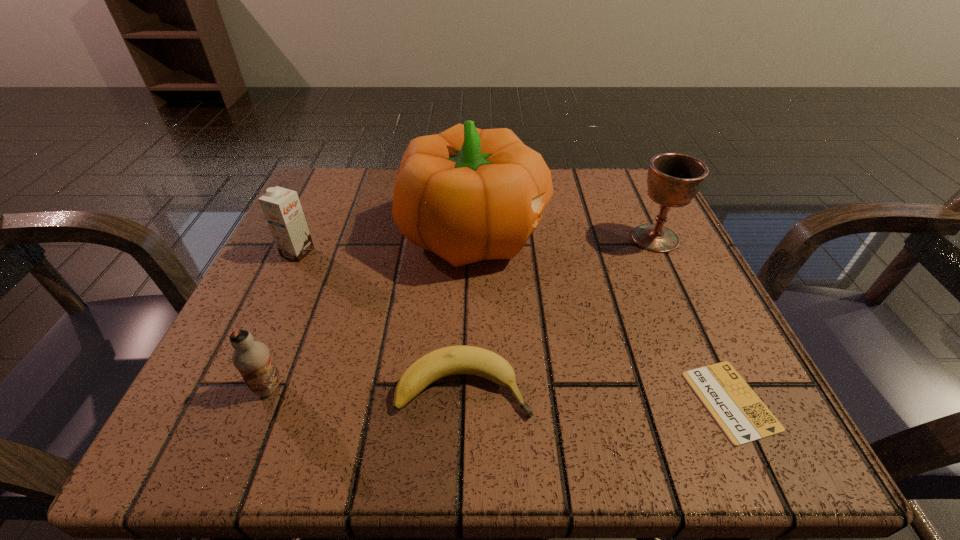
What are the coordinates of `pumpkin` in the screenshot? It's located at (466, 194).

You are a GUI agent. You are given a task and a screenshot of the screen. Output one action in this format:
    pyautogui.click(x=<x>, y=<y>)
    Task: Click on the chalice
    
    Given the screenshot: What is the action you would take?
    pyautogui.click(x=673, y=180)

Identify the location of the farther chocolate milk. This screenshot has width=960, height=540. (282, 209).

Find the location of a particular element. The width and height of the screenshot is (960, 540). the nearer chocolate milk is located at coordinates (252, 358).

Where is `the fifth tallest object`? the fifth tallest object is located at coordinates (451, 360).

Image resolution: width=960 pixels, height=540 pixels. In order to click on identity card in this screenshot , I will do `click(743, 417)`.

I want to click on free space located 0.070m on the carved face of the tallest object, so click(x=585, y=232).

Find the location of a particular element. vacant region located on the front of the second tallest object is located at coordinates (681, 293).

Locate an element on the screen. vacant point located on the front of the farther chocolate milk is located at coordinates (272, 307).

You are a GUI agent. You are given a task and a screenshot of the screen. Output one action in this format:
    pyautogui.click(x=<x>, y=<y>)
    Task: Click on the vacant region located 0.370m on the back of the nearer chocolate milk
    
    Given the screenshot: What is the action you would take?
    pyautogui.click(x=337, y=219)